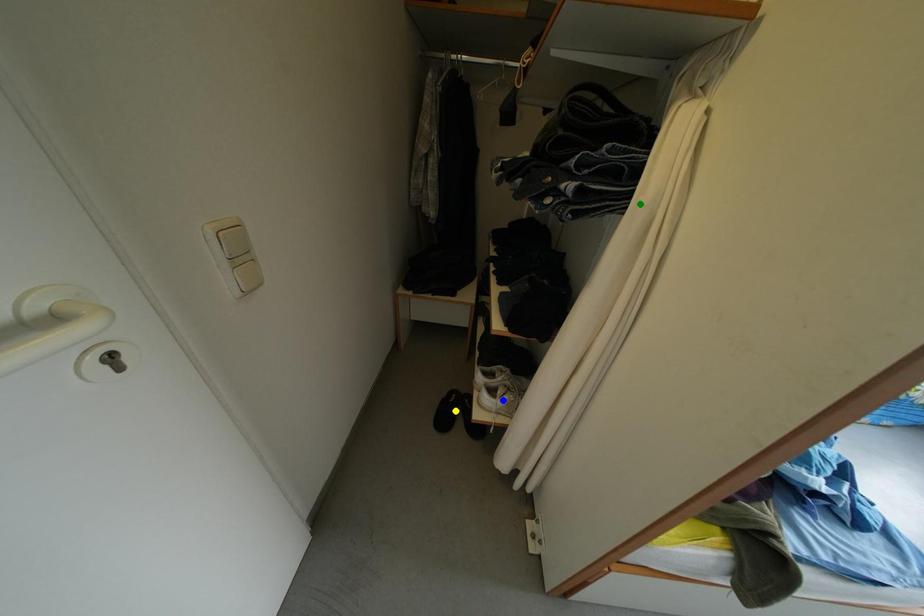
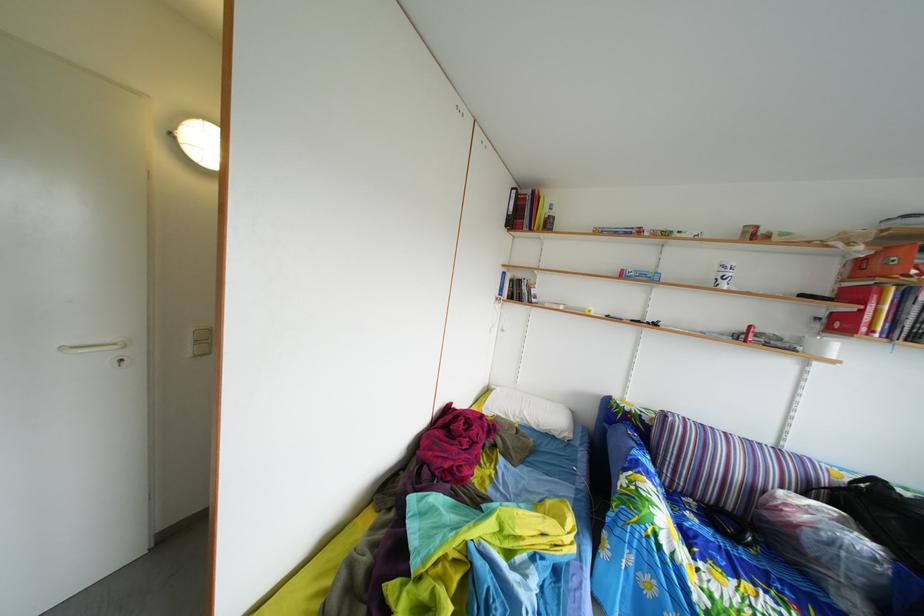
I am providing you with two images of the same scene from different viewpoints. Three points are marked in image1. Which point corresponds to a part or object that is occluded in image2?In image1, three points are marked. Which of them correspond to a part or object that is occluded in image2?Among the three points shown in image1, which one corresponds to a part or object that is no longer visible due to occlusion in image2?

blue point, yellow point, green point